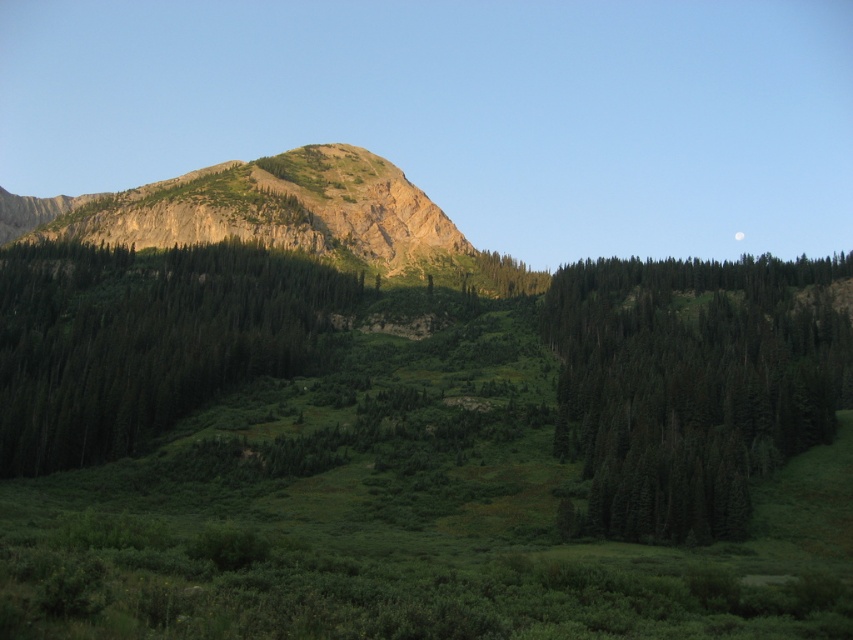
What do you see at coordinates (692, 384) in the screenshot? I see `green matte trees at right` at bounding box center [692, 384].

Can you confirm if green matte trees at right is smaller than rustic stone mountain at center?

Yes, green matte trees at right is smaller than rustic stone mountain at center.

Consider the image. Who is more forward, [561,285] or [448,244]?

Point [561,285] is more forward.

This screenshot has width=853, height=640. What are the coordinates of `green matte trees at right` in the screenshot? It's located at point(692,384).

Does point (776, 296) come closer to viewer compared to point (10, 307)?

Yes, it is in front of point (10, 307).

Between green matte trees at right and green textured trees at center, which one appears on the left side from the viewer's perspective?

From the viewer's perspective, green textured trees at center appears more on the left side.

Between point (782, 403) and point (106, 262), which one is positioned behind?

The point (106, 262) is more distant.

Locate an element on the screen. green matte trees at right is located at coordinates (692, 384).

Does green textured trees at center have a greater height compared to rustic stone mountain at center?

In fact, green textured trees at center may be shorter than rustic stone mountain at center.

The image size is (853, 640). What do you see at coordinates (143, 339) in the screenshot?
I see `green textured trees at center` at bounding box center [143, 339].

Locate an element on the screen. This screenshot has width=853, height=640. green textured trees at center is located at coordinates (143, 339).